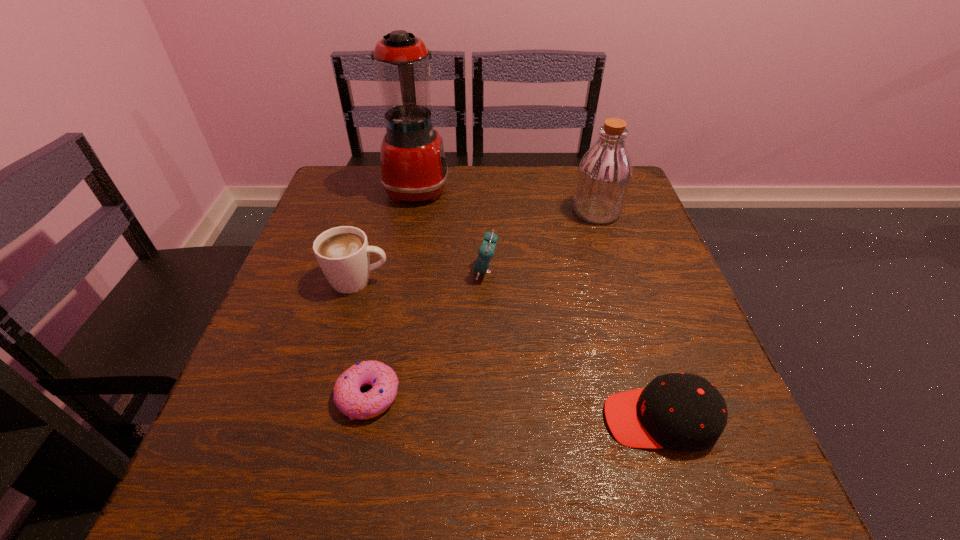
At what (x,y) coordinates should I click in order to perform the action: click on the closest object to the food processor. Please return your answer as a coordinate pair (x, y). This screenshot has height=540, width=960. Looking at the image, I should click on (486, 251).

Identify which object is the closest to the tallest object. Please provide its 2D coordinates. Your answer should be formatted as a tuple, i.e. [(x, y)], where the tuple contains the x and y coordinates of a point satisfying the conditions above.

[(486, 251)]

Locate an element on the screen. The width and height of the screenshot is (960, 540). blank area in the image that satisfies the following two spatial constraints: 1. on the controls of the food processor; 2. on the front side of the shortest object is located at coordinates 378,395.

Locate an element on the screen. The width and height of the screenshot is (960, 540). free spot that satisfies the following two spatial constraints: 1. on the controls of the food processor; 2. on the right side of the second tallest object is located at coordinates (413, 211).

The height and width of the screenshot is (540, 960). What are the coordinates of `vacant region that satisfies the following two spatial constraints: 1. on the back side of the bottle; 2. on the controls of the food processor` in the screenshot? It's located at (588, 188).

The image size is (960, 540). Identify the location of vacant region that satisfies the following two spatial constraints: 1. with the handle on the side of the shortest object; 2. on the right side of the cappuccino. (325, 395).